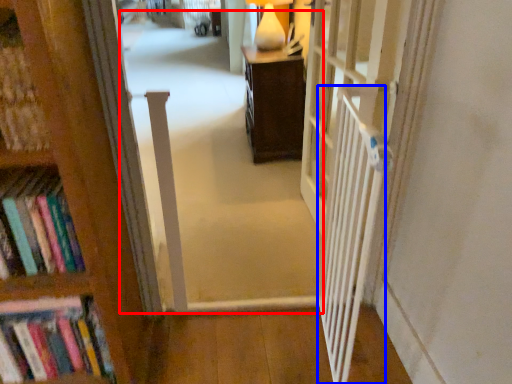
Question: Among these objects, which one is nearest to the camera, corridor (highlighted by a red box) or balustrade (highlighted by a blue box)?

Choices:
 (A) corridor
 (B) balustrade

Answer: (B)